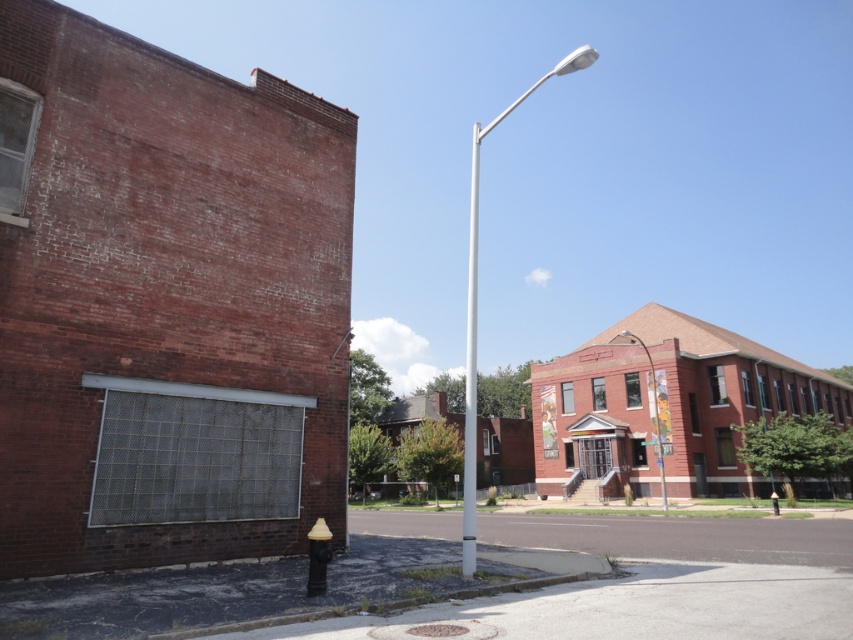
Question: Does white metallic pole at center appear under silver metallic pole at center?

Choices:
 (A) yes
 (B) no

Answer: (B)

Question: Which point is farther to the camera?

Choices:
 (A) metallic streetlight at center
 (B) silver metallic pole at center

Answer: (A)

Question: Does silver metallic pole at center come in front of metallic streetlight at center?

Choices:
 (A) yes
 (B) no

Answer: (A)

Question: Which point appears closest to the camera in this image?

Choices:
 (A) (474, 154)
 (B) (663, 468)
 (C) (577, 67)

Answer: (C)

Question: Does silver metallic pole at center appear on the left side of metallic streetlight at center?

Choices:
 (A) yes
 (B) no

Answer: (A)

Question: Which point is closer to the camera?

Choices:
 (A) metallic streetlight at center
 (B) white metallic pole at center

Answer: (B)